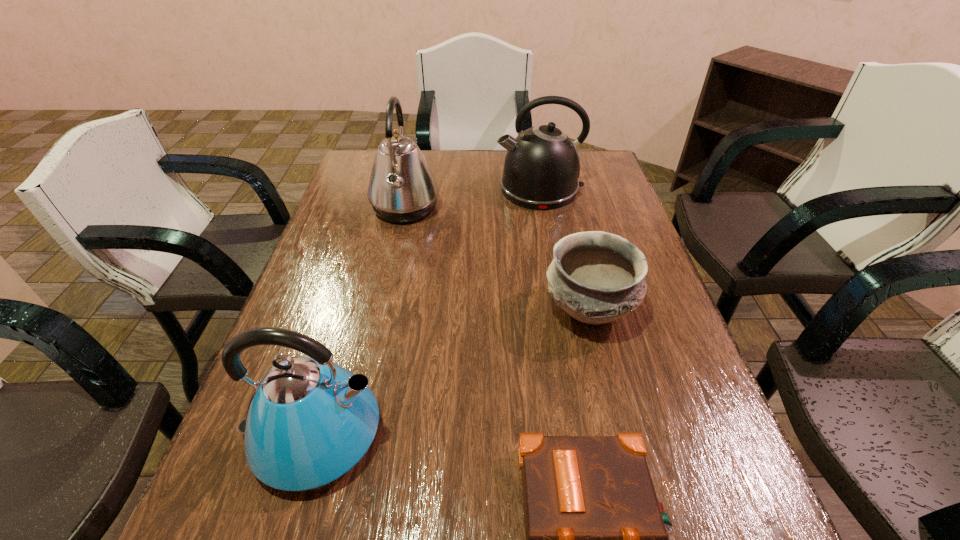
Identify the location of kettle at the right edge. (542, 166).

Find the location of a particular element. pottery positioned at the right edge is located at coordinates click(596, 277).

Where is `object situated at the far right corner`? This screenshot has width=960, height=540. object situated at the far right corner is located at coordinates (542, 166).

Find the location of `vacant space at the far edge`. vacant space at the far edge is located at coordinates (459, 185).

Locate an element on the screen. blank area at the left edge is located at coordinates (278, 513).

At what (x,y) coordinates should I click in order to perform the action: click on vacant area at the right edge. Please return your answer as a coordinate pair (x, y). The width and height of the screenshot is (960, 540). Looking at the image, I should click on (621, 194).

Where is `vacant space at the far right corner of the desktop`? The image size is (960, 540). vacant space at the far right corner of the desktop is located at coordinates (588, 180).

You are a GUI agent. You are given a task and a screenshot of the screen. Output one action in this format:
    pyautogui.click(x=<x>, y=<y>)
    Task: Click on the free space between the rightmost kettle and the nearest kettle
    The width and height of the screenshot is (960, 540).
    Given the screenshot: What is the action you would take?
    pyautogui.click(x=426, y=312)

At what (x,y) coordinates should I click in order to perform the action: click on free area in between the nearest kettle and the third nearest object. Please return your answer as a coordinate pair (x, y). Image resolution: width=960 pixels, height=540 pixels. Looking at the image, I should click on (451, 372).

Identify which object is located as the second nearest to the pottery. Please provide its 2D coordinates. Your answer should be formatted as a tuple, i.e. [(x, y)], where the tuple contains the x and y coordinates of a point satisfying the conditions above.

[(542, 166)]